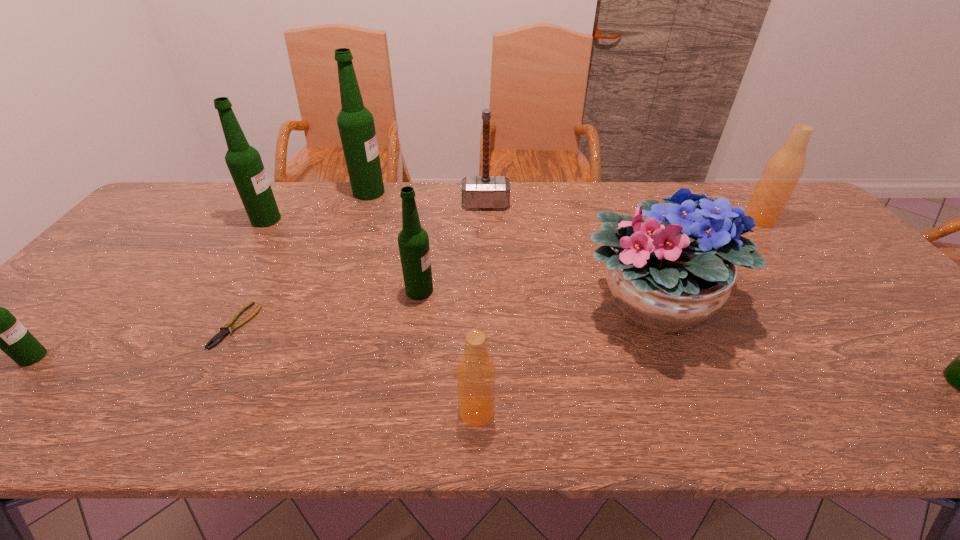
This screenshot has width=960, height=540. Identify the location of object that is at the far right corner. (785, 167).

Where is `vacant space at the far edge of the desktop`? This screenshot has height=540, width=960. vacant space at the far edge of the desktop is located at coordinates (560, 201).

At what (x,y) coordinates should I click in order to perform the action: click on free region at the near edge of the desktop. Please return your answer as a coordinate pair (x, y). The image size is (960, 540). Looking at the image, I should click on (85, 401).

The height and width of the screenshot is (540, 960). In the image, there is a desktop. Find the location of `free region at the left edge`. free region at the left edge is located at coordinates (54, 316).

Where is `free area in between the second object from right to left and the hammer`? Image resolution: width=960 pixels, height=540 pixels. free area in between the second object from right to left and the hammer is located at coordinates (622, 212).

I want to click on vacant area between the eighth object from right to left and the third nearest green beer bottle, so tap(328, 308).

Identify the location of vacant space in between the biggest green beer bottle and the bigger tan beer bottle. (564, 206).

Identify the location of free space that is in between the fourth nearest green beer bottle and the shortest object. (252, 273).

Locate an element on the screen. The height and width of the screenshot is (540, 960). free spot between the smallest green beer bottle and the blue bouquet is located at coordinates (342, 330).

This screenshot has height=540, width=960. What are the coordinates of `free space between the fifth beer bottle from left to right and the smallest green beer bottle` in the screenshot? It's located at (254, 384).